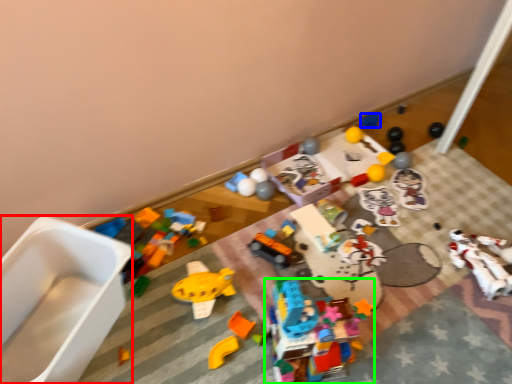
Question: Based on their relative distances, which object is farther from toy (highlighted by a red box)? Choose from toy (highlighted by a blue box) and toy (highlighted by a green box).

Choices:
 (A) toy
 (B) toy

Answer: (A)